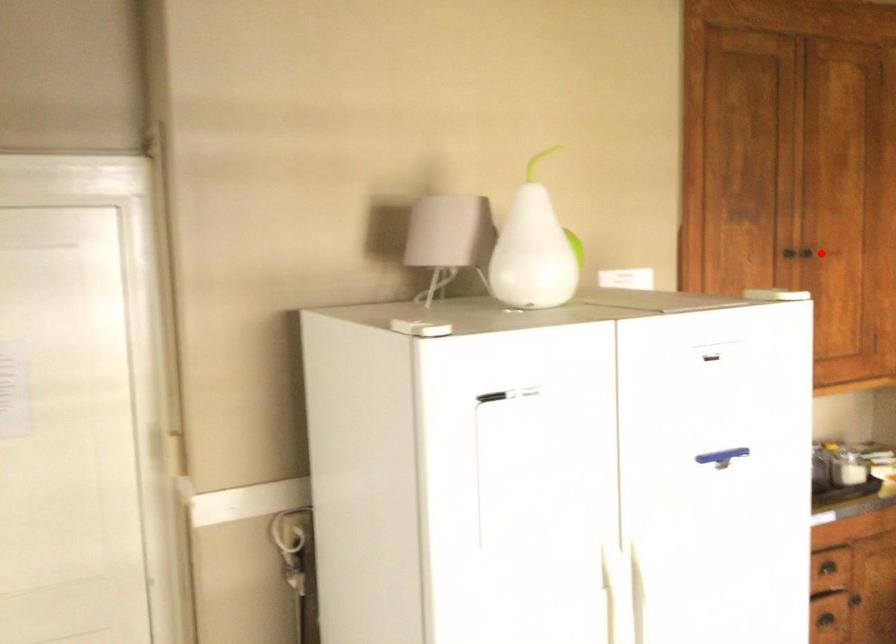
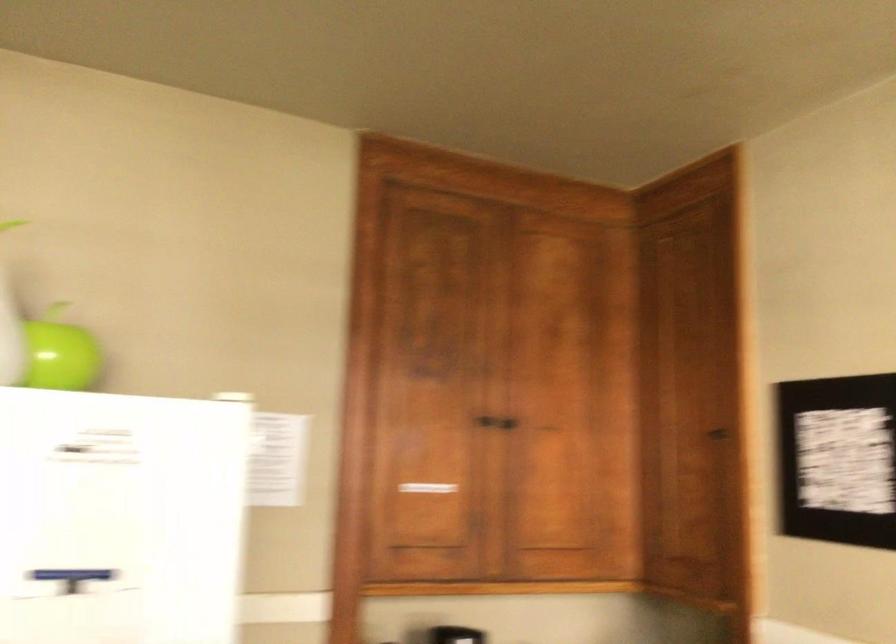
Where in the second image is the point corresponding to the highlighted location from the first image?

(511, 419)